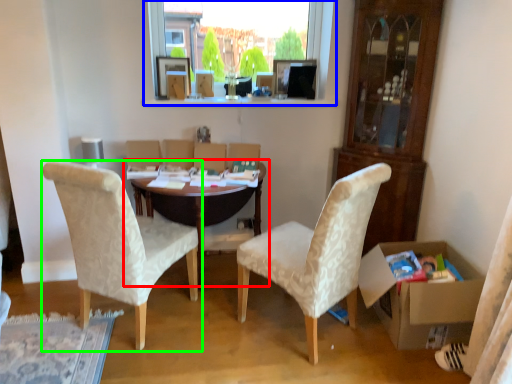
Question: Which object is positioned farthest from table (highlighted by a red box)? Select from window (highlighted by a blue box) and chair (highlighted by a green box).

Choices:
 (A) window
 (B) chair

Answer: (A)